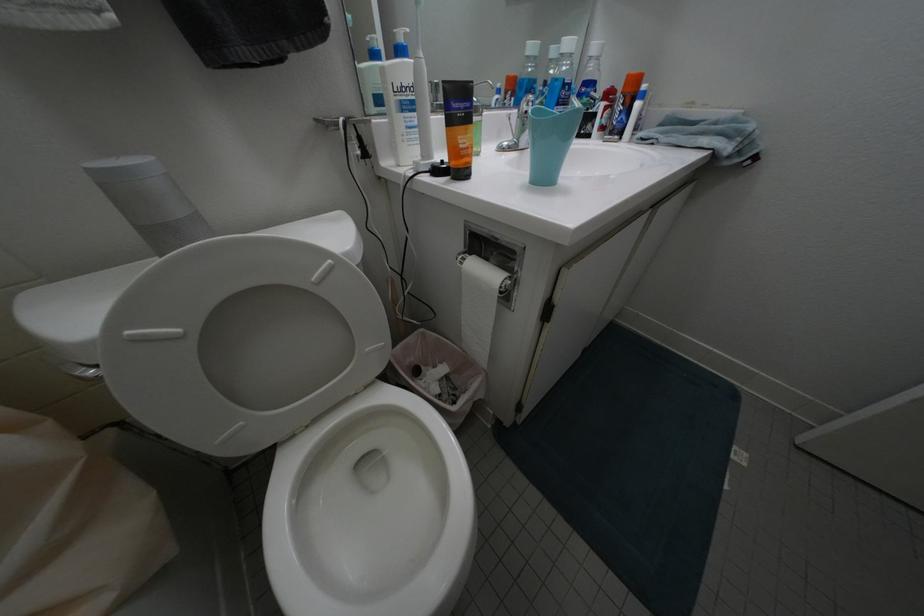
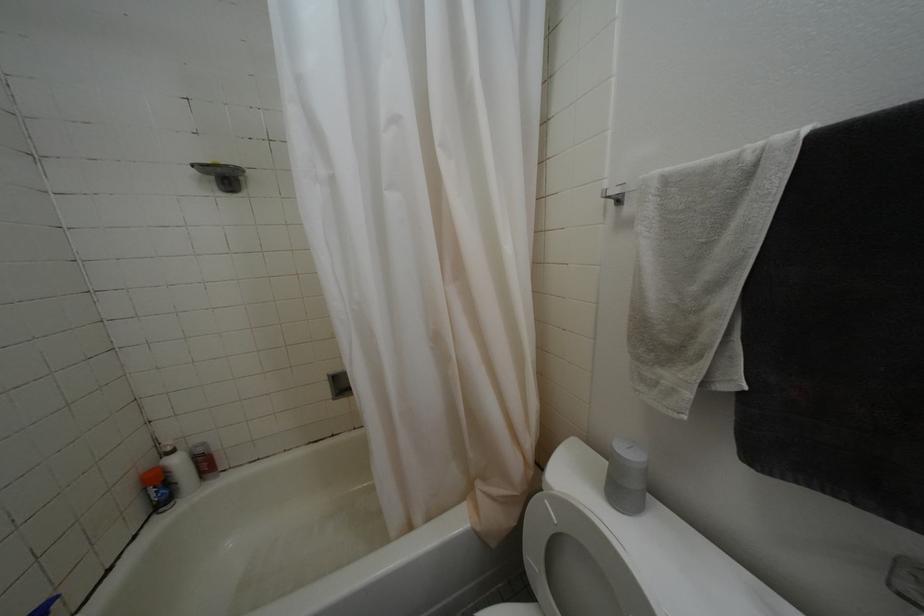
Consider the image. How did the camera likely rotate?

The rotation direction of the camera is left-down.